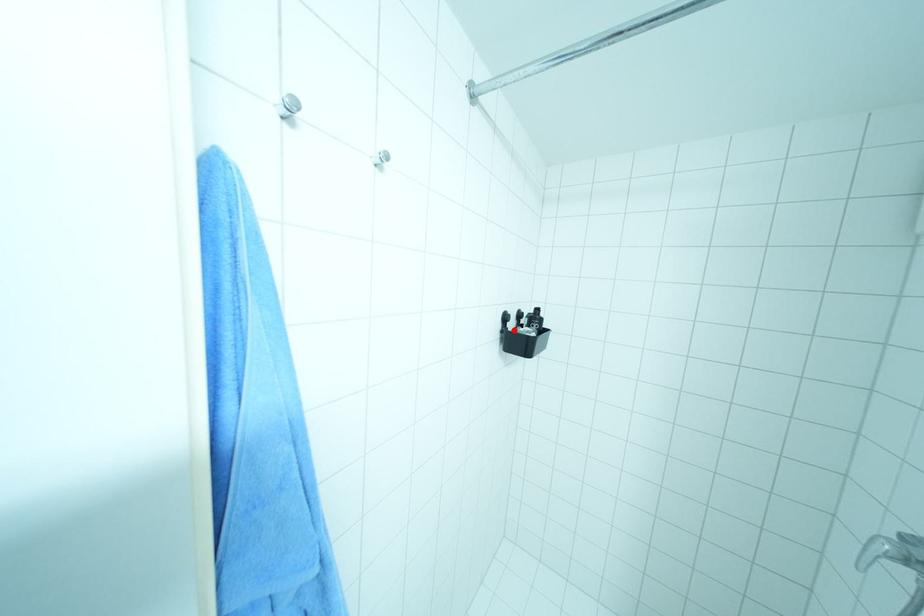
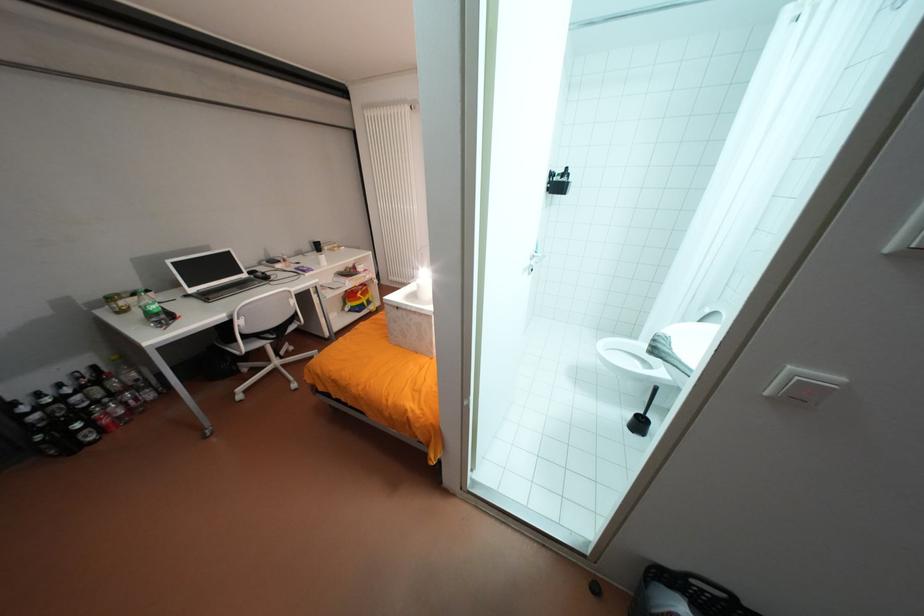
The point at the highlighted location is marked in the first image. Where is the corresponding point in the second image?

(558, 182)